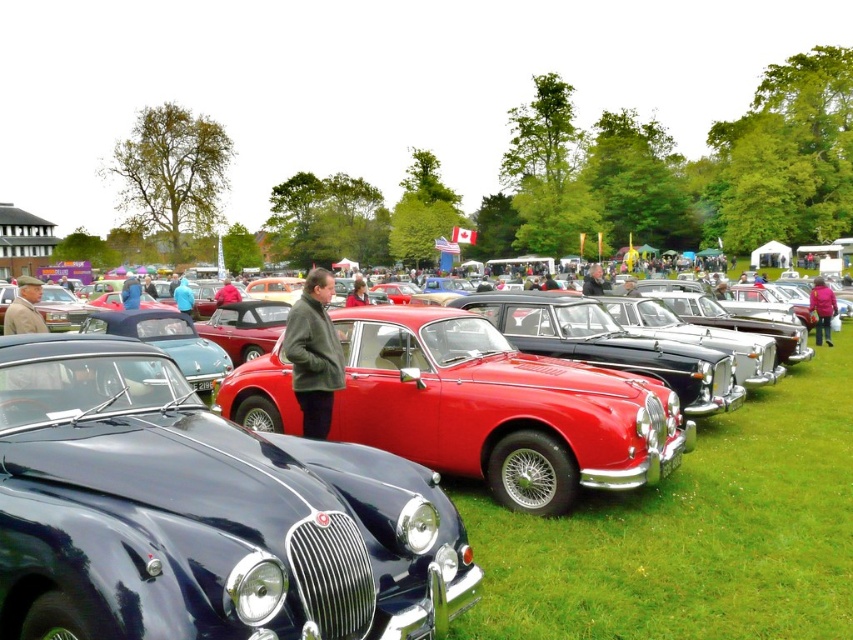
Can you confirm if pink fabric jacket at center is positioned below blue fabric jacket at center?

Indeed, pink fabric jacket at center is positioned under blue fabric jacket at center.

Between pink fabric jacket at center and blue fabric jacket at center, which one is positioned lower?

pink fabric jacket at center is below.

Does point (825, 320) lie behind point (177, 291)?

That is False.

Identify the location of pink fabric jacket at center. (822, 308).

Between shiny red car at center and blue fabric jacket at center, which one has less height?

Standing shorter between the two is shiny red car at center.

The width and height of the screenshot is (853, 640). Identify the location of shiny red car at center. pyautogui.click(x=692, y=532).

Is shiny red car at center positioned before green wool coat at center?

Yes, it is.

Who is lower down, shiny red car at center or green wool coat at center?

shiny red car at center is below.

Where is `shiny red car at center`? Image resolution: width=853 pixels, height=640 pixels. shiny red car at center is located at coordinates (692, 532).

Where is `shiny red car at center`? The height and width of the screenshot is (640, 853). shiny red car at center is located at coordinates (692, 532).